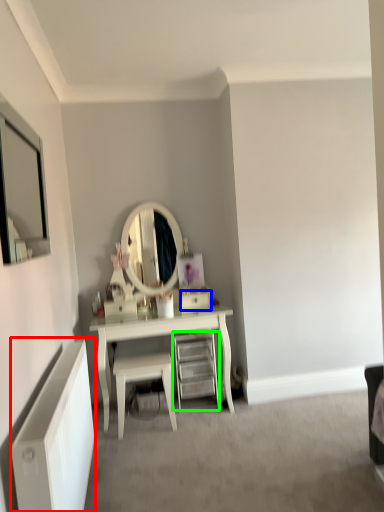
Question: Considering the real-world distances, which object is farthest from radiator (highlighted by a red box)? drawer (highlighted by a blue box) or shelf (highlighted by a green box)?

Choices:
 (A) drawer
 (B) shelf

Answer: (A)